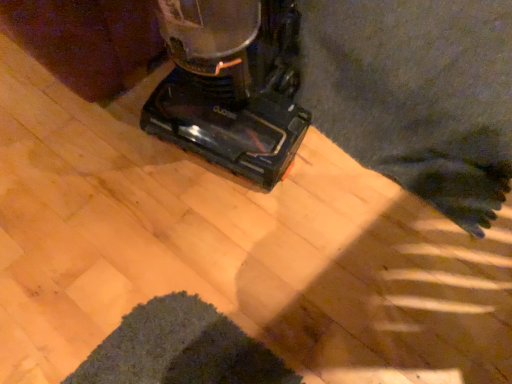
What are the coordinates of `free point in front of black plastic vacuum cleaner at center` in the screenshot? It's located at (239, 256).